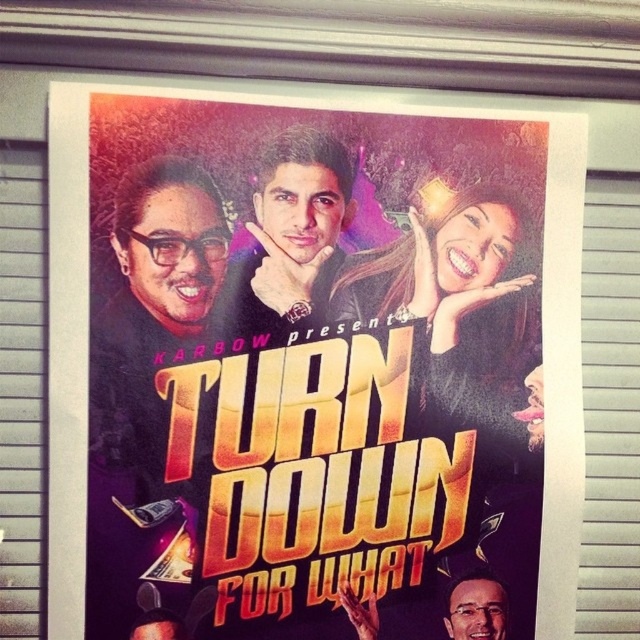
You are holding a measuring tool and need to determine if a 24 inch ruler can reach from the camera to the point at coordinates point (x=100, y=486). Can the ruler reach that point?

The point point (x=100, y=486) is 23.29 inches from the camera, so a 24 inch ruler can reach it since it is shorter than the ruler.

You are an artist planning to paint a miniature version of the poster. You need to ensure that the black matte hair at upper center and the smooth skin face at lower right are proportionally accurate. Which of these two elements should you make larger in your painting?

The black matte hair at upper center should be made larger than the smooth skin face at lower right to maintain proportional accuracy.